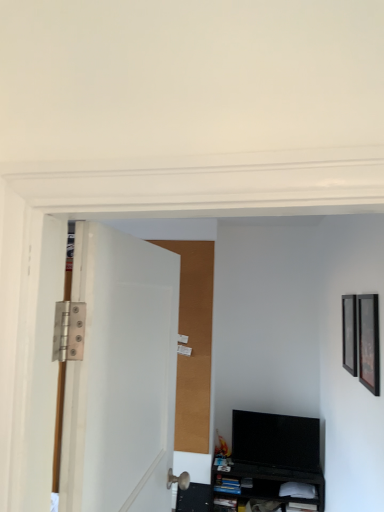
Question: Considering the relative sizes of black matte shelf at lower center and black matte picture frame at right, acting as the 2th picture frame starting from the front, in the image provided, is black matte shelf at lower center bigger than black matte picture frame at right, acting as the 2th picture frame starting from the front,?

Choices:
 (A) yes
 (B) no

Answer: (A)

Question: Is black matte shelf at lower center taller than black matte picture frame at right, marked as the 1th picture frame in a back-to-front arrangement?

Choices:
 (A) yes
 (B) no

Answer: (B)

Question: Does black matte shelf at lower center lie behind black matte picture frame at right, marked as the 1th picture frame in a back-to-front arrangement?

Choices:
 (A) no
 (B) yes

Answer: (B)

Question: Would you say black matte shelf at lower center contains black matte picture frame at right, acting as the 2th picture frame starting from the front?

Choices:
 (A) yes
 (B) no

Answer: (B)

Question: Is black matte shelf at lower center facing away from black matte picture frame at right, marked as the 1th picture frame in a back-to-front arrangement?

Choices:
 (A) no
 (B) yes

Answer: (A)

Question: Are black matte shelf at lower center and black matte picture frame at right, positioned as the 1th picture frame in right-to-left order, located far from each other?

Choices:
 (A) yes
 (B) no

Answer: (A)

Question: From the image's perspective, is black glossy tv at lower right under black matte shelf at lower center?

Choices:
 (A) no
 (B) yes

Answer: (A)

Question: Does black glossy tv at lower right lie in front of black matte shelf at lower center?

Choices:
 (A) no
 (B) yes

Answer: (B)

Question: Is black glossy tv at lower right completely or partially outside of black matte shelf at lower center?

Choices:
 (A) yes
 (B) no

Answer: (A)

Question: Does black glossy tv at lower right have a larger size compared to black matte shelf at lower center?

Choices:
 (A) yes
 (B) no

Answer: (A)

Question: From a real-world perspective, is black glossy tv at lower right positioned over black matte shelf at lower center based on gravity?

Choices:
 (A) no
 (B) yes

Answer: (B)

Question: From a real-world perspective, is black glossy tv at lower right beneath black matte shelf at lower center?

Choices:
 (A) yes
 (B) no

Answer: (B)

Question: Does white matte door at left have a larger size compared to black glossy picture frame at right, placed as the first picture frame when sorted from left to right?

Choices:
 (A) no
 (B) yes

Answer: (B)